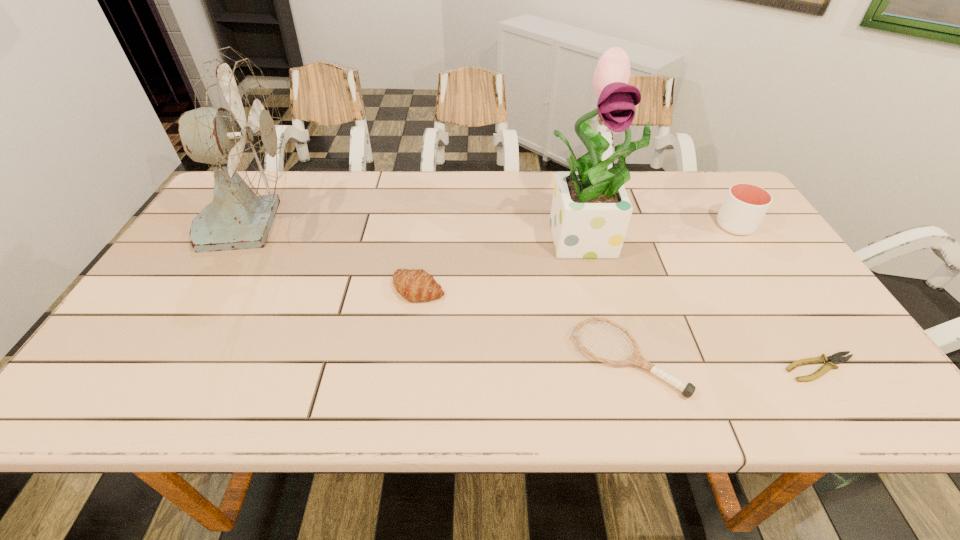
Where is `pliers that is positioned at the right edge`? The width and height of the screenshot is (960, 540). pliers that is positioned at the right edge is located at coordinates (836, 358).

Where is `object present at the far left corner`? This screenshot has width=960, height=540. object present at the far left corner is located at coordinates (236, 128).

Where is `object present at the far right corner`? Image resolution: width=960 pixels, height=540 pixels. object present at the far right corner is located at coordinates (745, 205).

Find the location of a particular element. object located in the near right corner section of the desktop is located at coordinates (836, 358).

In order to click on free space at the far edge of the desktop in this screenshot , I will do `click(354, 199)`.

Locate an element on the screen. The image size is (960, 540). vacant space at the near edge of the desktop is located at coordinates (269, 406).

Identify the location of free location at the left edge of the desktop. (138, 323).

At what (x,y) coordinates should I click in order to perform the action: click on free space between the flower arrangement and the second shortest object. Please return your answer as a coordinate pair (x, y). This screenshot has width=960, height=540. Looking at the image, I should click on (608, 298).

I want to click on unoccupied position between the leftmost object and the shortest object, so click(x=536, y=295).

This screenshot has width=960, height=540. I want to click on free area in between the flower arrangement and the leftmost object, so click(x=420, y=230).